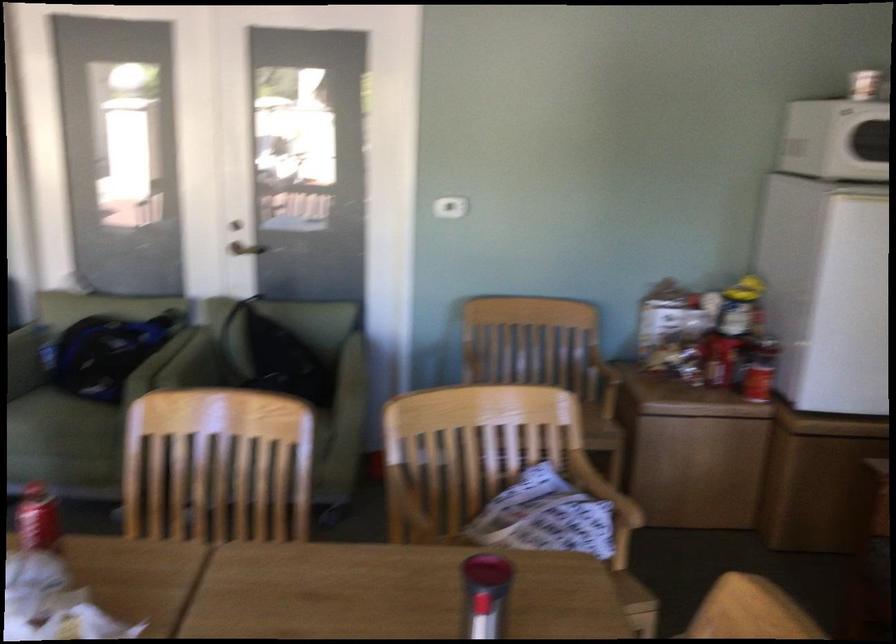
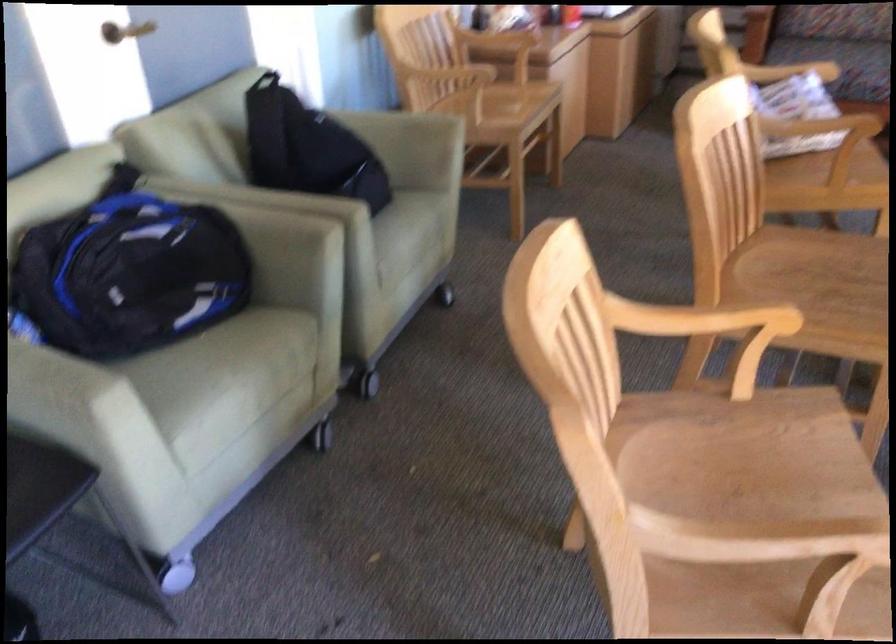
The point at (372, 547) is marked in the first image. Where is the corresponding point in the second image?

(823, 126)